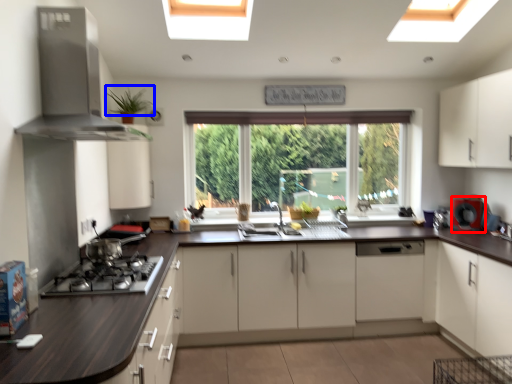
Question: Which point is further to the camera, appliance (highlighted by a red box) or plant (highlighted by a blue box)?

Choices:
 (A) appliance
 (B) plant

Answer: (A)